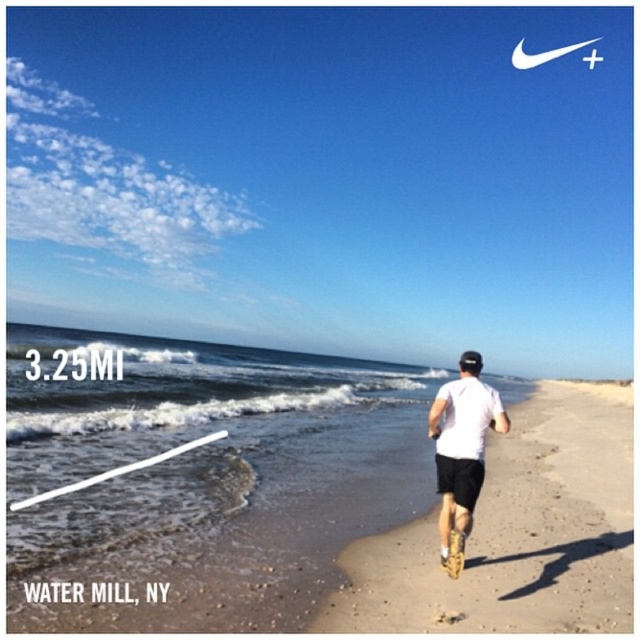
Based on the photo, you are a runner preparing to jog along the sandy beach at center and the white matte shirt at center. Based on the scene, which object is positioned lower in the image?

The sandy beach at center is located below the white matte shirt at center, so the sandy beach at center is positioned lower in the image.

You are a runner who just finished a jog on the sandy beach at center and see your white matte shirt at center. If you want to place your shirt on the beach, will it fit without overlapping the edges?

The sandy beach at center has a larger size compared to the white matte shirt at center, so yes, the shirt will fit without overlapping the edges since the beach is bigger.

Looking at this image, you are a photographer trying to capture the jogger in the scene. The sandy beach at center and the white matte shirt at center are both in your viewfinder. Based on their sizes in the image, which object would appear larger?

The sandy beach at center appears larger than the white matte shirt at center because the sandy beach at center is wider than the white matte shirt at center according to the description.